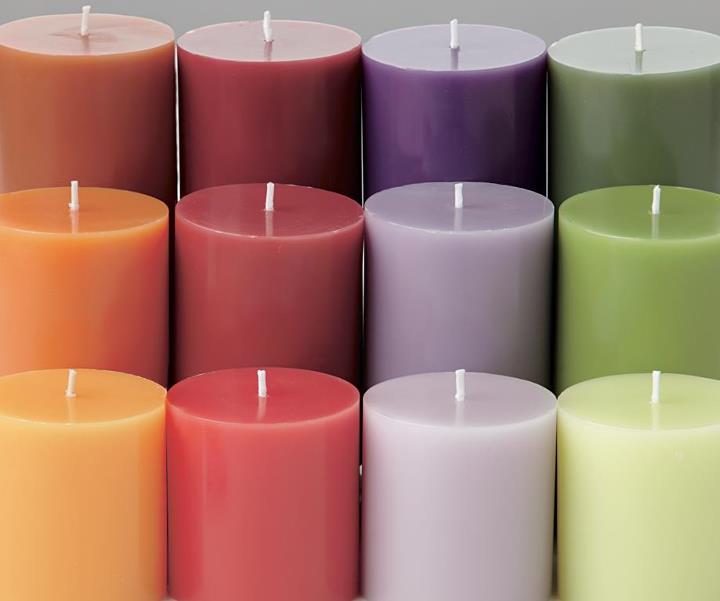
Locate an element on the screen. candles in middle row is located at coordinates (71, 309), (271, 306), (448, 305), (639, 299).